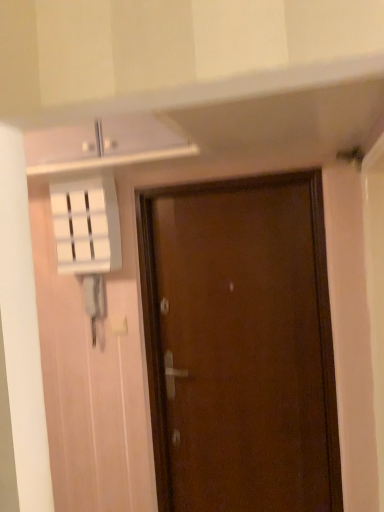
Find the location of a particular element. This screenshot has height=512, width=384. brown matte door at center is located at coordinates (240, 346).

Image resolution: width=384 pixels, height=512 pixels. Describe the element at coordinates (240, 346) in the screenshot. I see `brown matte door at center` at that location.

What is the approximate height of brown matte door at center?

The height of brown matte door at center is 1.65 meters.

What is the approximate width of brown matte door at center?

4.14 inches.

You are a GUI agent. You are given a task and a screenshot of the screen. Output one action in this format:
    pyautogui.click(x=<x>, y=<y>)
    Task: Click on the brown matte door at center
    This screenshot has height=512, width=384.
    Given the screenshot: What is the action you would take?
    pyautogui.click(x=240, y=346)